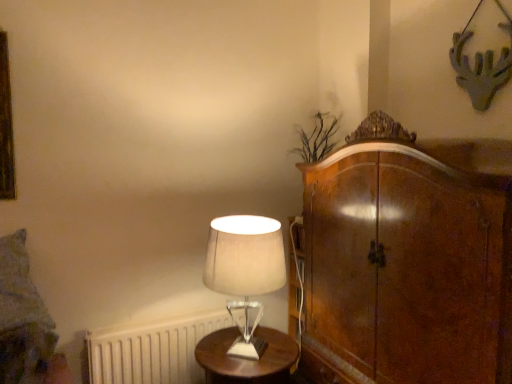
Question: Considering the relative sizes of white fabric lampshade at center and wooden round table at center in the image provided, is white fabric lampshade at center shorter than wooden round table at center?

Choices:
 (A) yes
 (B) no

Answer: (B)

Question: Is white fabric lampshade at center directly adjacent to wooden round table at center?

Choices:
 (A) yes
 (B) no

Answer: (B)

Question: Is white fabric lampshade at center positioned with its back to wooden round table at center?

Choices:
 (A) no
 (B) yes

Answer: (A)

Question: Is the depth of white fabric lampshade at center less than that of wooden round table at center?

Choices:
 (A) yes
 (B) no

Answer: (A)

Question: From the image's perspective, is white fabric lampshade at center located above wooden round table at center?

Choices:
 (A) no
 (B) yes

Answer: (B)

Question: Are white fabric lampshade at center and wooden round table at center far apart?

Choices:
 (A) yes
 (B) no

Answer: (B)

Question: Can you confirm if white fabric lampshade at center is shorter than white matte radiator at lower left?

Choices:
 (A) yes
 (B) no

Answer: (B)

Question: Can you confirm if white fabric lampshade at center is positioned to the left of white matte radiator at lower left?

Choices:
 (A) no
 (B) yes

Answer: (A)

Question: Considering the relative sizes of white fabric lampshade at center and white matte radiator at lower left in the image provided, is white fabric lampshade at center smaller than white matte radiator at lower left?

Choices:
 (A) no
 (B) yes

Answer: (A)

Question: From a real-world perspective, is white fabric lampshade at center physically below white matte radiator at lower left?

Choices:
 (A) yes
 (B) no

Answer: (B)

Question: Considering the relative sizes of white fabric lampshade at center and white matte radiator at lower left in the image provided, is white fabric lampshade at center thinner than white matte radiator at lower left?

Choices:
 (A) yes
 (B) no

Answer: (B)

Question: Is white fabric lampshade at center completely or partially outside of white matte radiator at lower left?

Choices:
 (A) yes
 (B) no

Answer: (A)

Question: Does wooden round table at center have a larger size compared to white matte radiator at lower left?

Choices:
 (A) yes
 (B) no

Answer: (A)